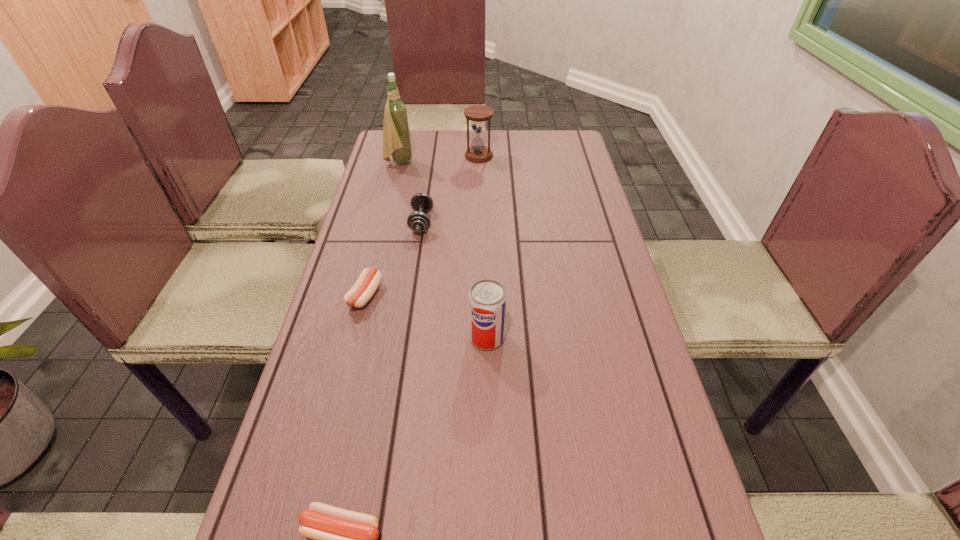
This screenshot has width=960, height=540. I want to click on wine bottle, so click(396, 135).

At what (x,y) coordinates should I click in order to perform the action: click on hourglass. Please return your answer as a coordinate pair (x, y). Looking at the image, I should click on (478, 153).

Identify the location of soda. (487, 300).

Where is `dumbbell`? dumbbell is located at coordinates (418, 221).

This screenshot has width=960, height=540. Identify the location of the fourth nearest object. (418, 221).

At what (x,y) coordinates should I click in order to perform the action: click on the farther sausage. Please return your answer as a coordinate pair (x, y). This screenshot has width=960, height=540. Looking at the image, I should click on (366, 285).

The height and width of the screenshot is (540, 960). In order to click on free space located 0.070m on the front-facing side of the wine bottle in this screenshot , I will do `click(433, 162)`.

This screenshot has height=540, width=960. In order to click on vacant region located 0.160m on the right of the hourglass in this screenshot , I will do `click(538, 156)`.

Where is `vacant region located on the front of the second nearest object`? The width and height of the screenshot is (960, 540). vacant region located on the front of the second nearest object is located at coordinates (490, 501).

Locate an element on the screen. The height and width of the screenshot is (540, 960). free space located on the back of the fourth nearest object is located at coordinates (432, 150).